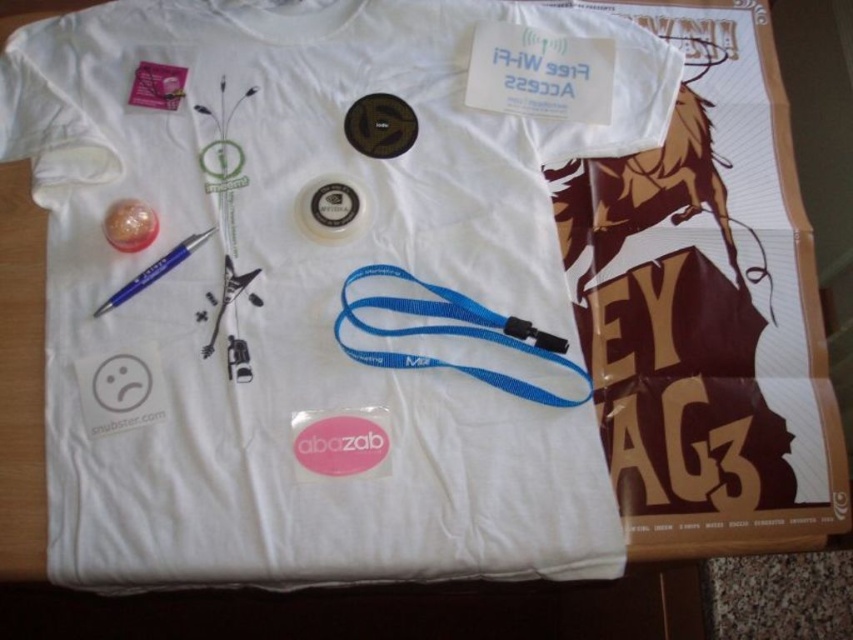
Question: Is the position of blue plastic pen at upper left less distant than that of metallic silver guitar at center?

Choices:
 (A) no
 (B) yes

Answer: (A)

Question: Which of the following is the farthest from the observer?

Choices:
 (A) (109, 68)
 (B) (177, 250)

Answer: (A)

Question: Among these objects, which one is farthest from the camera?

Choices:
 (A) metallic silver guitar at center
 (B) white paper poster at upper right
 (C) white matte sad face at lower left
 (D) blue plastic pen at upper left

Answer: (D)

Question: From the image, what is the correct spatial relationship of white fabric t-shirt at center in relation to white paper poster at upper right?

Choices:
 (A) left
 (B) right

Answer: (A)

Question: Does white fabric t-shirt at center lie in front of white matte sad face at lower left?

Choices:
 (A) no
 (B) yes

Answer: (B)

Question: Which of these objects is positioned closest to the white matte sad face at lower left?

Choices:
 (A) blue plastic pen at upper left
 (B) white fabric t-shirt at center

Answer: (A)